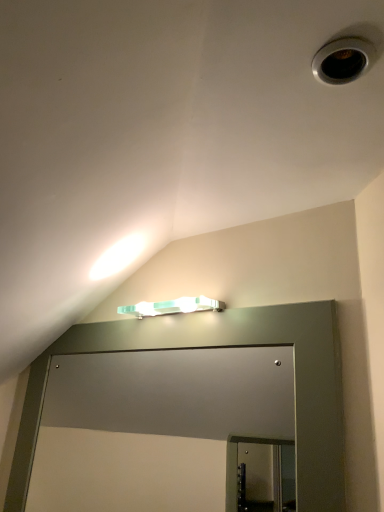
Describe the element at coordinates (154, 426) in the screenshot. I see `matte gray glass door at center` at that location.

The image size is (384, 512). Identify the location of matte gray glass door at center. (154, 426).

In order to face matte gray glass door at center, should I rotate leftwards or rightwards?

Rotate left and turn 6.602 degrees.

Locate an element on the screen. The width and height of the screenshot is (384, 512). mint green plastic light fixture at upper center is located at coordinates (172, 307).

What do you see at coordinates (172, 307) in the screenshot?
I see `mint green plastic light fixture at upper center` at bounding box center [172, 307].

The width and height of the screenshot is (384, 512). Find the location of `matte gray glass door at center`. matte gray glass door at center is located at coordinates (154, 426).

Which is more to the left, matte gray glass door at center or mint green plastic light fixture at upper center?

matte gray glass door at center is more to the left.

Consider the image. Considering their positions, is matte gray glass door at center located in front of or behind mint green plastic light fixture at upper center?

matte gray glass door at center is positioned closer to the viewer than mint green plastic light fixture at upper center.

Considering the points (109, 438) and (177, 302), which point is in front, point (109, 438) or point (177, 302)?

The point (177, 302) is closer to the camera.

From the image's perspective, who appears lower, matte gray glass door at center or mint green plastic light fixture at upper center?

matte gray glass door at center appears lower in the image.

In the scene shown: From a real-world perspective, is matte gray glass door at center located higher than mint green plastic light fixture at upper center?

Incorrect, from a real-world perspective, matte gray glass door at center is lower than mint green plastic light fixture at upper center.

Does matte gray glass door at center have a lesser width compared to mint green plastic light fixture at upper center?

Indeed, matte gray glass door at center has a lesser width compared to mint green plastic light fixture at upper center.

Considering the relative sizes of matte gray glass door at center and mint green plastic light fixture at upper center in the image provided, is matte gray glass door at center taller than mint green plastic light fixture at upper center?

Indeed, matte gray glass door at center has a greater height compared to mint green plastic light fixture at upper center.

In terms of size, does matte gray glass door at center appear bigger or smaller than mint green plastic light fixture at upper center?

matte gray glass door at center is bigger than mint green plastic light fixture at upper center.

Is mint green plastic light fixture at upper center completely or partially inside matte gray glass door at center?

Definitely not — mint green plastic light fixture at upper center is not inside matte gray glass door at center.

Would you consider matte gray glass door at center to be distant from mint green plastic light fixture at upper center?

They are positioned close to each other.

Is matte gray glass door at center facing away from mint green plastic light fixture at upper center?

matte gray glass door at center is not turned away from mint green plastic light fixture at upper center.

How many degrees apart are the facing directions of matte gray glass door at center and mint green plastic light fixture at upper center?

There is a 0.00632-degree angle between the facing directions of matte gray glass door at center and mint green plastic light fixture at upper center.

Measure the distance between matte gray glass door at center and mint green plastic light fixture at upper center.

23.74 inches.

Find the location of a particular element. glass door lying on the left of mint green plastic light fixture at upper center is located at coordinates (154, 426).

Can you confirm if mint green plastic light fixture at upper center is positioned to the left of matte gray glass door at center?

No, mint green plastic light fixture at upper center is not to the left of matte gray glass door at center.

Does mint green plastic light fixture at upper center lie in front of matte gray glass door at center?

No, mint green plastic light fixture at upper center is further to the viewer.

Which is in front, point (140, 316) or point (148, 447)?

The point (140, 316) is closer to the camera.

From the image's perspective, is mint green plastic light fixture at upper center positioned above or below matte gray glass door at center?

Based on their image positions, mint green plastic light fixture at upper center is located above matte gray glass door at center.

From a real-world perspective, which object stands above the other?

mint green plastic light fixture at upper center.

Can you confirm if mint green plastic light fixture at upper center is thinner than matte gray glass door at center?

Incorrect, the width of mint green plastic light fixture at upper center is not less than that of matte gray glass door at center.

Considering the sizes of objects mint green plastic light fixture at upper center and matte gray glass door at center in the image provided, who is shorter, mint green plastic light fixture at upper center or matte gray glass door at center?

Standing shorter between the two is mint green plastic light fixture at upper center.

Considering the relative sizes of mint green plastic light fixture at upper center and matte gray glass door at center in the image provided, is mint green plastic light fixture at upper center smaller than matte gray glass door at center?

Correct, mint green plastic light fixture at upper center occupies less space than matte gray glass door at center.

Is matte gray glass door at center completely or partially inside mint green plastic light fixture at upper center?

Definitely not — matte gray glass door at center is not inside mint green plastic light fixture at upper center.

Is the surface of mint green plastic light fixture at upper center in direct contact with matte gray glass door at center?

mint green plastic light fixture at upper center is not next to matte gray glass door at center, and they're not touching.

Is mint green plastic light fixture at upper center oriented away from matte gray glass door at center?

No, mint green plastic light fixture at upper center's orientation is not away from matte gray glass door at center.

The width and height of the screenshot is (384, 512). I want to click on lamp that is behind the matte gray glass door at center, so click(x=172, y=307).

Identify the location of lamp that appears above the matte gray glass door at center (from the image's perspective). pos(172,307).

I want to click on glass door located on the left of mint green plastic light fixture at upper center, so click(x=154, y=426).